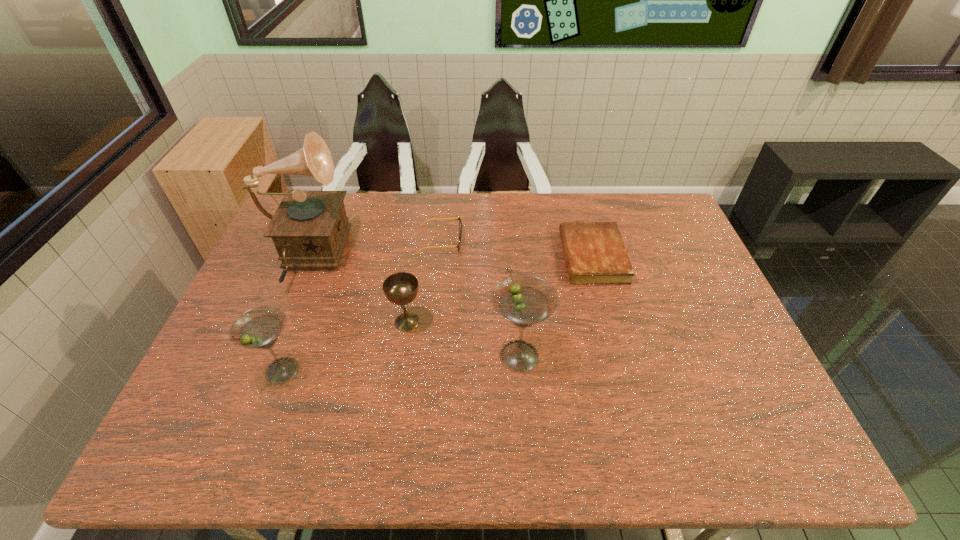
Locate an element on the screen. This screenshot has width=960, height=540. vacant space located on the front-facing side of the spectacles is located at coordinates [x=529, y=240].

At what (x,y) coordinates should I click in order to perform the action: click on blank space located on the spine side of the Bible. Please return your answer as a coordinate pair (x, y). The image size is (960, 540). Looking at the image, I should click on (x=544, y=256).

This screenshot has height=540, width=960. I want to click on free space located 0.310m on the spine side of the Bible, so click(466, 256).

Find the location of a particular element. This screenshot has height=540, width=960. free space located 0.190m on the spine side of the Bible is located at coordinates (503, 256).

Where is `free spot located on the horn of the record player`? free spot located on the horn of the record player is located at coordinates click(x=418, y=259).

Find the location of a particular element. vacant space located 0.280m on the left of the chalice is located at coordinates (289, 322).

This screenshot has height=540, width=960. I want to click on spectacles positioned at the far edge, so click(x=460, y=222).

The width and height of the screenshot is (960, 540). What are the coordinates of `Bible that is at the far edge` in the screenshot? It's located at (595, 253).

Where is `record player located at the far edge`? This screenshot has height=540, width=960. record player located at the far edge is located at coordinates (309, 229).

I want to click on martini located at the left edge, so click(x=258, y=328).